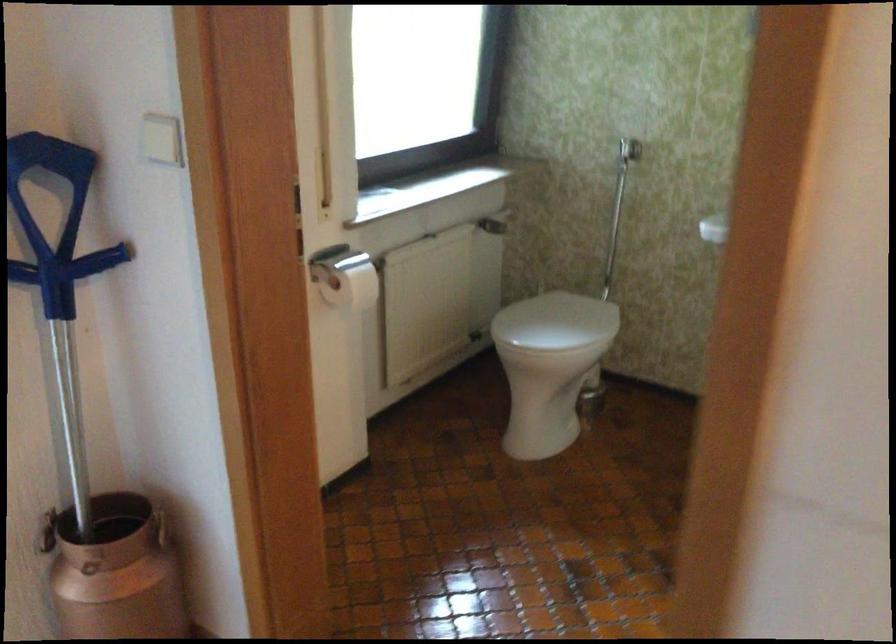
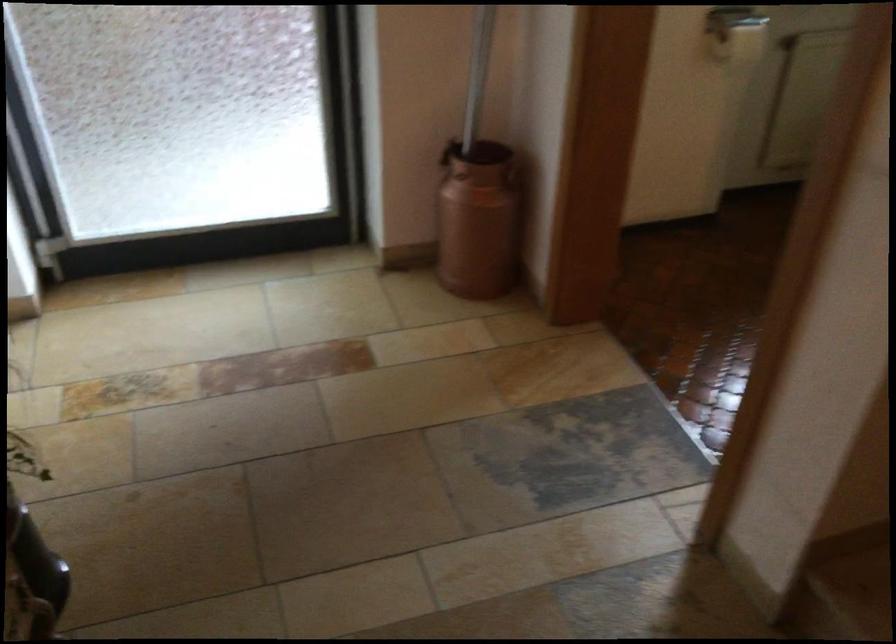
Question: I am providing you with two images of the same scene from different viewpoints. Please identify which objects are invisible in image2.

Choices:
 (A) long pole handle
 (B) copper milk can
 (C) milk can handle
 (D) none of these

Answer: (D)